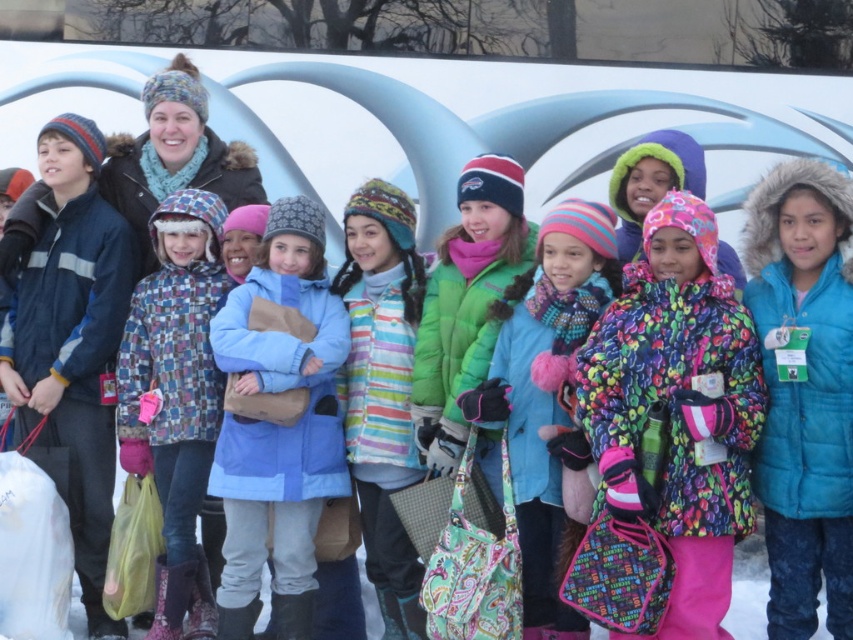
Question: Can you confirm if blue quilted jacket at center is positioned to the left of fluffy pink mittens at center?

Choices:
 (A) no
 (B) yes

Answer: (A)

Question: Does blue quilted jacket at center have a lesser width compared to plaid fabric coat at center?

Choices:
 (A) no
 (B) yes

Answer: (B)

Question: Which point is closer to the camera?

Choices:
 (A) blue quilted jacket at center
 (B) light blue fabric coat at center
 (C) fluffy pink mittens at center

Answer: (A)

Question: Which object is closer to the camera taking this photo?

Choices:
 (A) light blue fabric coat at center
 (B) fluffy pink mittens at center

Answer: (B)

Question: Can you confirm if blue quilted jacket at center is smaller than fluffy pink mittens at center?

Choices:
 (A) yes
 (B) no

Answer: (A)

Question: Among these objects, which one is nearest to the camera?

Choices:
 (A) plaid fabric coat at center
 (B) blue quilted jacket at center

Answer: (B)